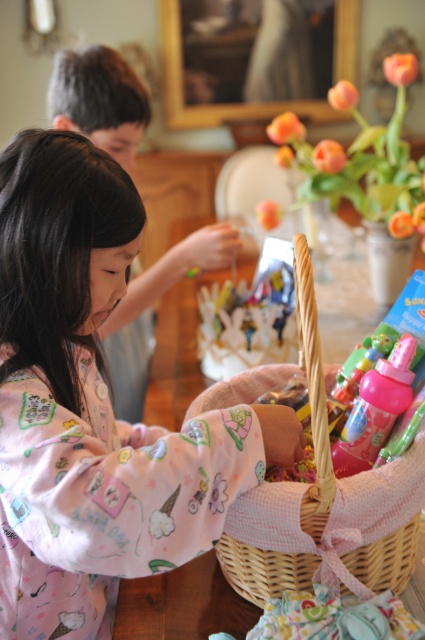
Question: Can you confirm if pink cotton pajamas at left is positioned to the right of woven wicker basket at center?

Choices:
 (A) no
 (B) yes

Answer: (A)

Question: Which object is closer to the camera taking this photo?

Choices:
 (A) woven wicker basket at center
 (B) pink fabric at center

Answer: (A)

Question: Which is nearer to the woven wicker basket at center?

Choices:
 (A) pink fabric at center
 (B) pink cotton pajamas at left

Answer: (B)

Question: Among these points, which one is nearest to the camera?

Choices:
 (A) (70, 120)
 (B) (210, 426)

Answer: (B)

Question: Observing the image, what is the correct spatial positioning of woven wicker basket at center in reference to pink fabric at center?

Choices:
 (A) above
 (B) below

Answer: (B)

Question: From the image, what is the correct spatial relationship of woven wicker basket at center in relation to pink fabric at center?

Choices:
 (A) below
 (B) above

Answer: (A)